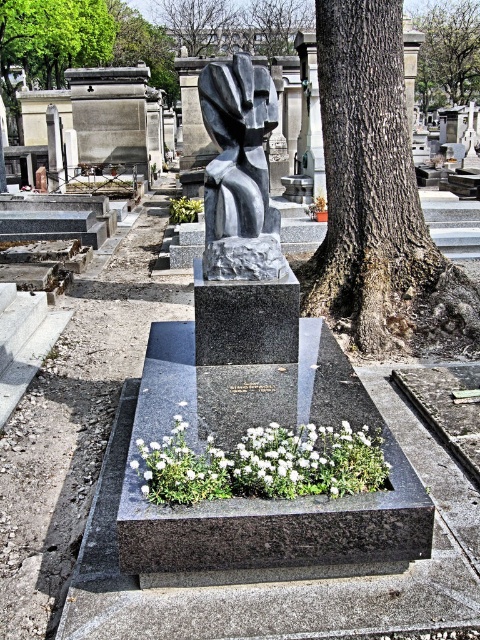
Question: Is the position of brown textured tree trunk at upper center less distant than that of green leafy tree at upper left?

Choices:
 (A) no
 (B) yes

Answer: (A)

Question: Which point is farther to the camera?

Choices:
 (A) green leafy tree at center
 (B) slate gray stone sculpture at center

Answer: (A)

Question: Which object is closer to the camera taking this photo?

Choices:
 (A) slate gray stone sculpture at center
 (B) brown rough bark tree at center
 (C) brown textured tree trunk at upper center

Answer: (A)

Question: Is the position of white matte flowers at center less distant than that of brown textured tree at upper center?

Choices:
 (A) no
 (B) yes

Answer: (B)

Question: Is slate gray stone sculpture at center positioned before green leafy tree at upper center?

Choices:
 (A) no
 (B) yes

Answer: (B)

Question: Which object appears farthest from the camera in this image?

Choices:
 (A) white matte flowers at center
 (B) brown textured tree at upper center
 (C) slate gray stone sculpture at center

Answer: (B)